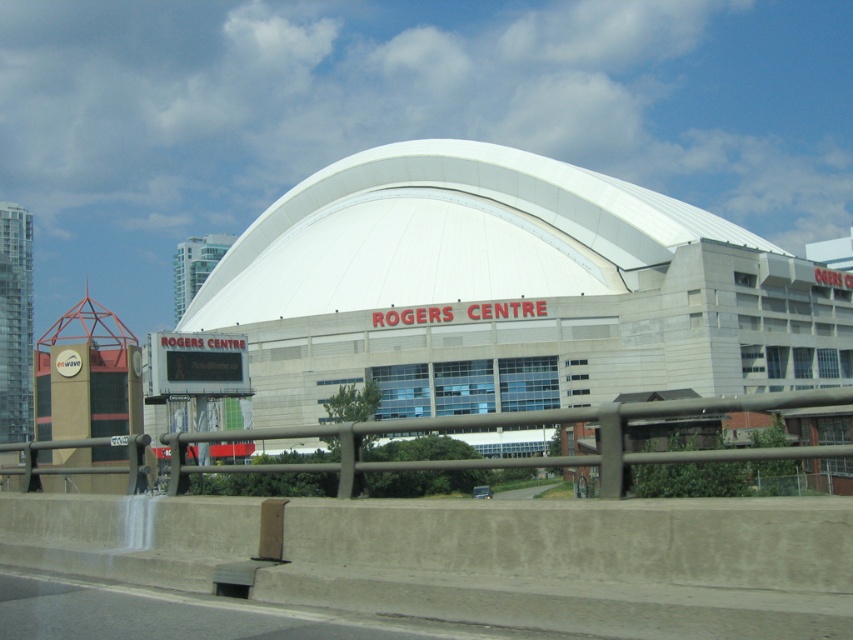
Question: Which of the following is the closest to the observer?

Choices:
 (A) (534, 156)
 (B) (262, 432)
 (C) (613, 346)

Answer: (B)

Question: Which of these objects is positioned closest to the brown metal/rail at lower center?

Choices:
 (A) matte brown building at center
 (B) white smooth dome at center

Answer: (A)

Question: In this image, where is matte brown building at center located relative to white smooth dome at center?

Choices:
 (A) right
 (B) left

Answer: (B)

Question: Does matte brown building at center appear under brown metal/rail at lower center?

Choices:
 (A) yes
 (B) no

Answer: (B)

Question: Estimate the real-world distances between objects in this image. Which object is closer to the white smooth dome at center?

Choices:
 (A) matte brown building at center
 (B) brown metal/rail at lower center

Answer: (A)

Question: Is matte brown building at center wider than white smooth dome at center?

Choices:
 (A) no
 (B) yes

Answer: (B)